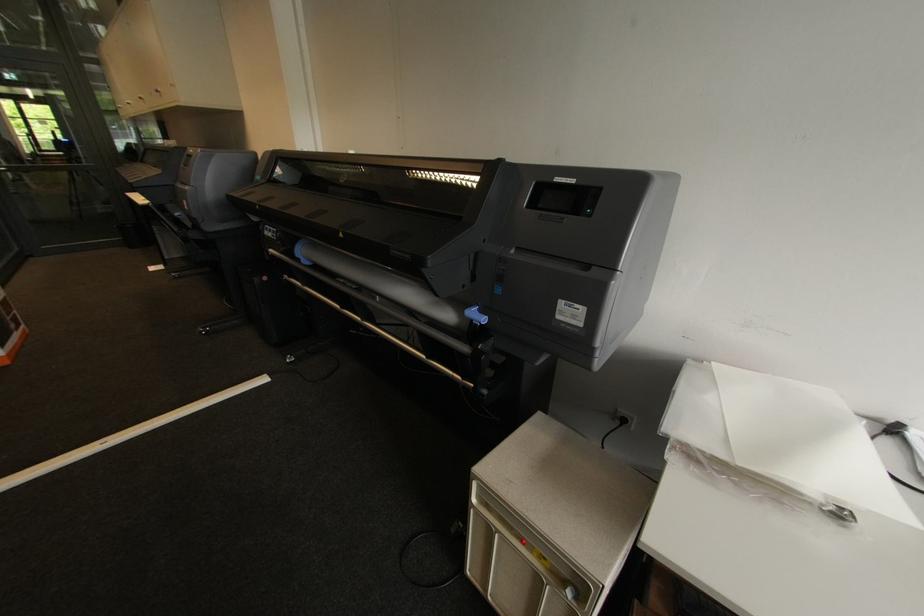
This screenshot has height=616, width=924. I want to click on blue printer lever, so click(x=476, y=315).